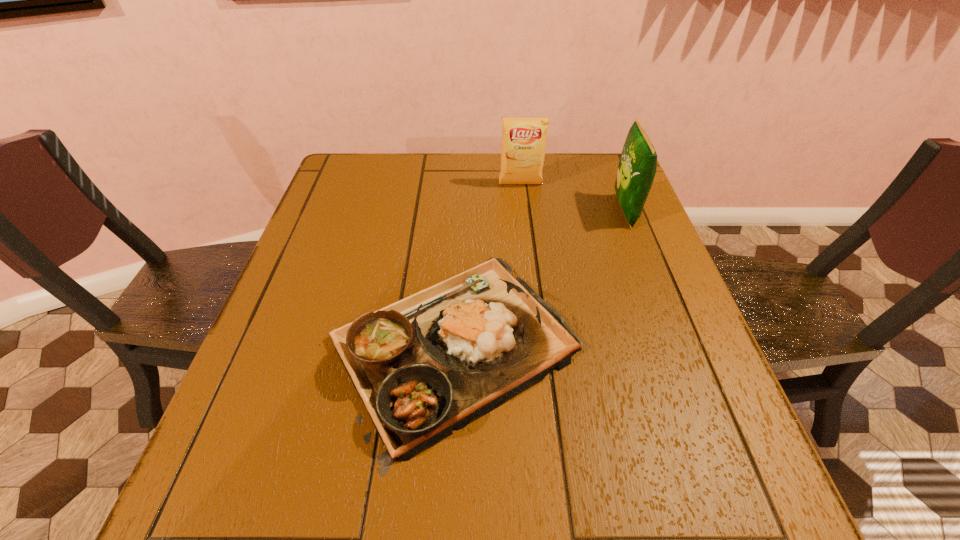
Identify the location of object that is the second closest to the rightmost object. Image resolution: width=960 pixels, height=540 pixels. (426, 365).